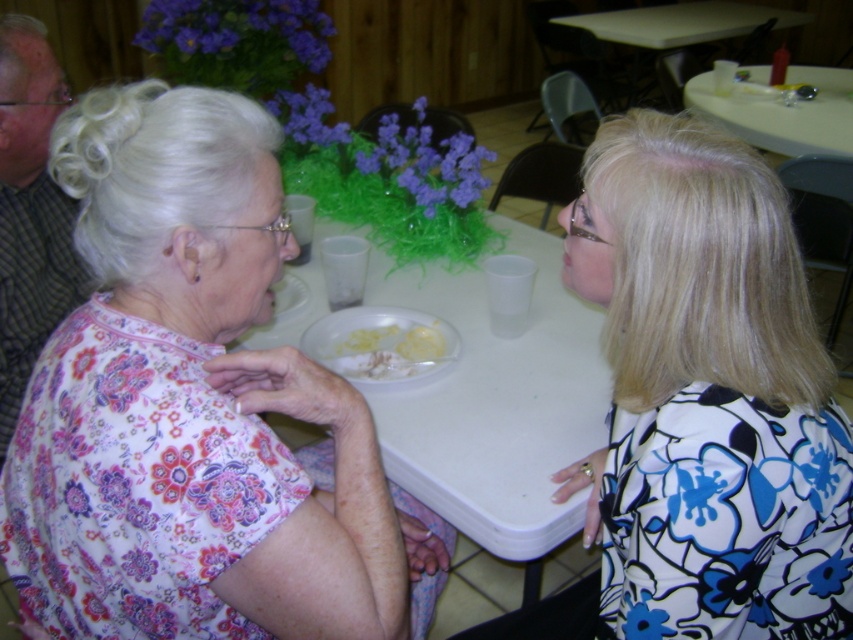
You are standing at the center of the room and want to move towards the white plastic table at upper right. Which direction should you walk to reach it?

Since the white plastic table at upper right is located at point 0.177 on the x and 0.920 on the y coordinate, you should walk towards the upper right direction to reach it.